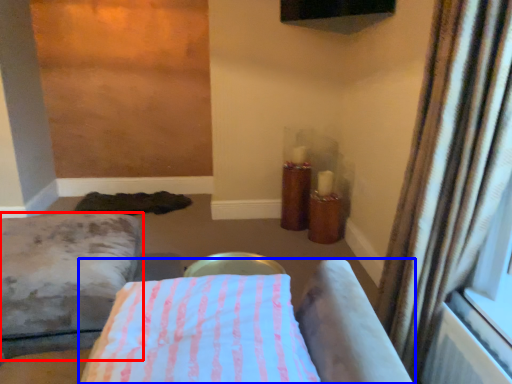
Question: Which point is further to the camera, furniture (highlighted by a red box) or furniture (highlighted by a blue box)?

Choices:
 (A) furniture
 (B) furniture

Answer: (A)